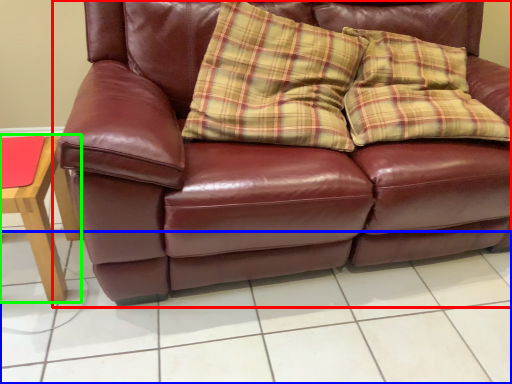
Question: Considering the real-world distances, which object is farthest from studio couch (highlighted by a red box)? tile (highlighted by a blue box) or table (highlighted by a green box)?

Choices:
 (A) tile
 (B) table

Answer: (B)